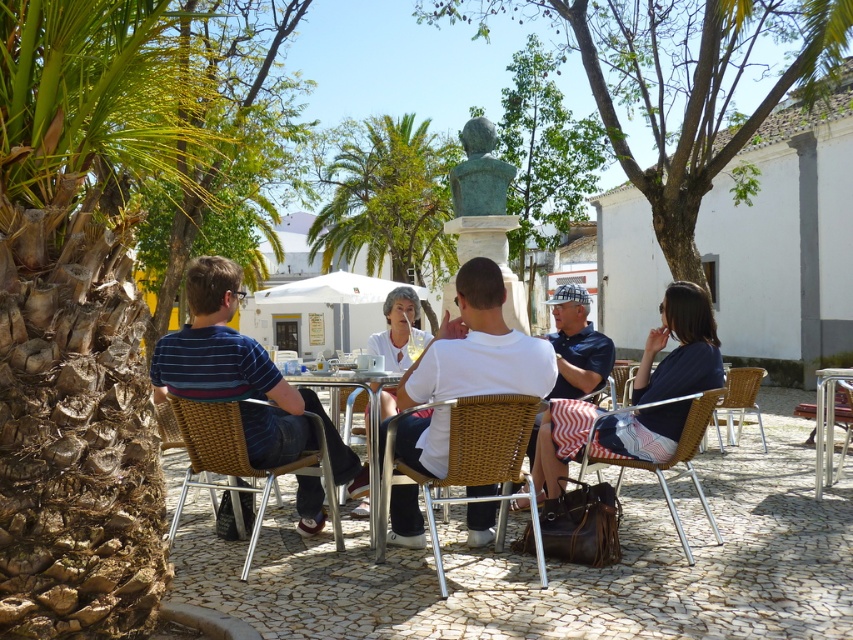
Question: Is blue denim shorts at center in front of metallic silver table at center?

Choices:
 (A) yes
 (B) no

Answer: (B)

Question: Based on their relative distances, which object is farther from the metallic silver table at lower right?

Choices:
 (A) striped fabric shorts at center
 (B) rattan chair at lower center
 (C) white wicker chair at center

Answer: (C)

Question: Can you confirm if green leafy palm tree at left is positioned to the right of metallic silver table at lower right?

Choices:
 (A) yes
 (B) no

Answer: (B)

Question: Which object is the closest to the white cotton shirt at center?

Choices:
 (A) green leafy palm tree at center
 (B) metallic silver table at lower right
 (C) metallic silver table at center

Answer: (C)

Question: Is white wicker chair at center above woven wicker chair at center?

Choices:
 (A) no
 (B) yes

Answer: (B)

Question: Based on their relative distances, which object is nearer to the bronze statue at center?

Choices:
 (A) white wicker chair at center
 (B) white cotton shirt at center

Answer: (B)